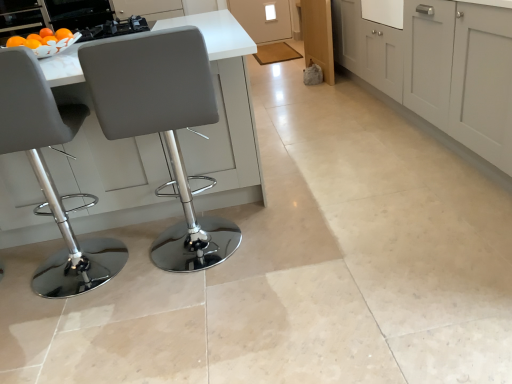
Question: Would you say metallic black stove at upper left is part of matte gray stool at left, arranged as the 1th chair when viewed from the left,'s contents?

Choices:
 (A) no
 (B) yes

Answer: (A)

Question: Is matte gray stool at left, the second chair from the right, to the left of metallic black stove at upper left from the viewer's perspective?

Choices:
 (A) yes
 (B) no

Answer: (B)

Question: Is matte gray stool at left, arranged as the 1th chair when viewed from the left, positioned beyond the bounds of metallic black stove at upper left?

Choices:
 (A) no
 (B) yes

Answer: (B)

Question: Is matte gray stool at left, the second chair from the right, behind metallic black stove at upper left?

Choices:
 (A) yes
 (B) no

Answer: (B)

Question: From the image's perspective, does matte gray stool at left, arranged as the 1th chair when viewed from the left, appear higher than metallic black stove at upper left?

Choices:
 (A) no
 (B) yes

Answer: (A)

Question: Is matte gray stool at left, the second chair from the right, situated inside matte gray cabinets at center, marked as the 2th cabinetry in a back-to-front arrangement, or outside?

Choices:
 (A) inside
 (B) outside

Answer: (B)

Question: Does point (38, 139) appear closer or farther from the camera than point (503, 99)?

Choices:
 (A) farther
 (B) closer

Answer: (B)

Question: Is matte gray stool at left, the second chair from the right, in front of or behind matte gray cabinets at center, which is the second cabinetry from left to right, in the image?

Choices:
 (A) behind
 (B) front

Answer: (B)

Question: From the image's perspective, relative to matte gray cabinets at center, which appears as the second cabinetry when viewed from the top, is matte gray stool at left, arranged as the 1th chair when viewed from the left, above or below?

Choices:
 (A) below
 (B) above

Answer: (A)

Question: Choose the correct answer: Is matte gray stool at left, the second chair from the right, inside matte gray chair at left, the second chair in the left-to-right sequence, or outside it?

Choices:
 (A) outside
 (B) inside

Answer: (A)

Question: Based on their positions, is matte gray stool at left, the second chair from the right, located to the left or right of matte gray chair at left, the second chair in the left-to-right sequence?

Choices:
 (A) right
 (B) left

Answer: (B)

Question: Considering the positions of matte gray stool at left, arranged as the 1th chair when viewed from the left, and matte gray chair at left, the second chair in the left-to-right sequence, in the image, is matte gray stool at left, arranged as the 1th chair when viewed from the left, wider or thinner than matte gray chair at left, the second chair in the left-to-right sequence,?

Choices:
 (A) wide
 (B) thin

Answer: (B)

Question: Is matte gray stool at left, the second chair from the right, taller or shorter than matte gray chair at left, the second chair in the left-to-right sequence?

Choices:
 (A) tall
 (B) short

Answer: (A)

Question: From a real-world perspective, relative to metallic black stove at upper left, is matte gray stool at left, arranged as the 1th chair when viewed from the left, vertically above or below?

Choices:
 (A) above
 (B) below

Answer: (B)

Question: Considering their positions, is matte gray stool at left, arranged as the 1th chair when viewed from the left, located in front of or behind metallic black stove at upper left?

Choices:
 (A) behind
 (B) front

Answer: (B)